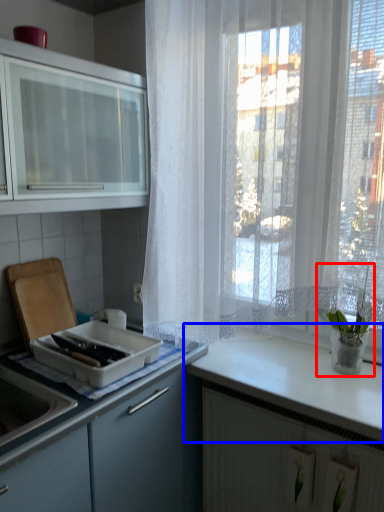
Question: Which object is further to the camera taking this photo, houseplant (highlighted by a red box) or countertop (highlighted by a blue box)?

Choices:
 (A) houseplant
 (B) countertop

Answer: (A)